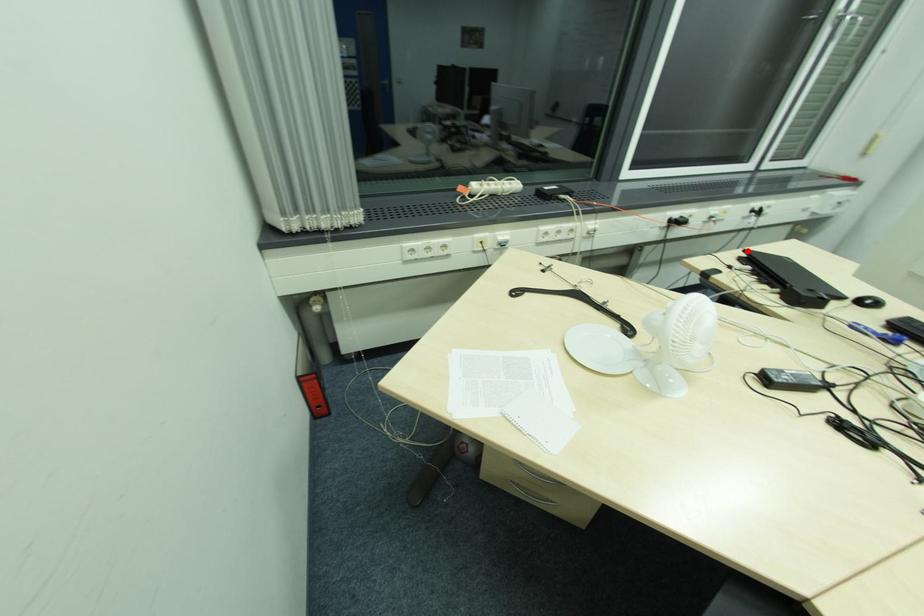
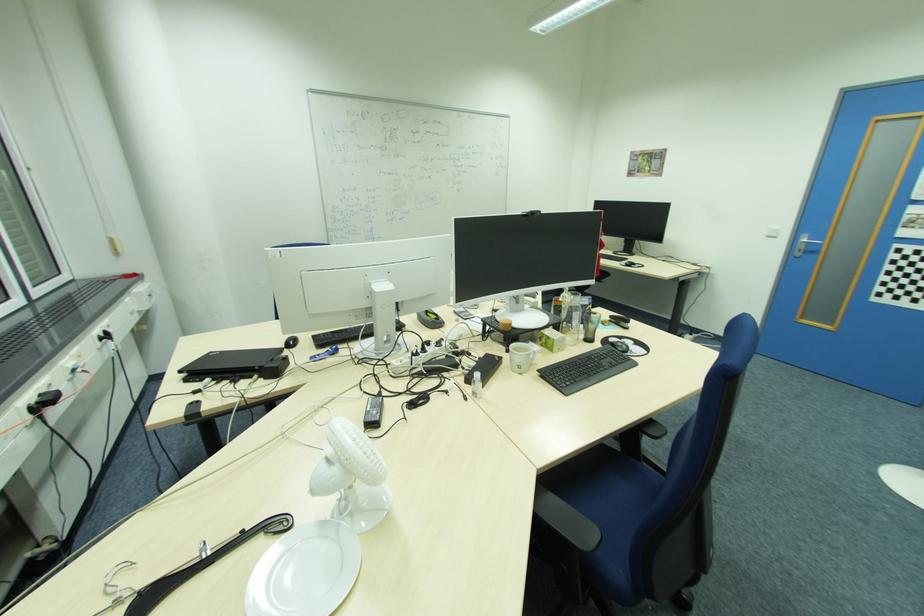
In the second image, find the point that corresponds to the highlighted location in the first image.

(183, 371)